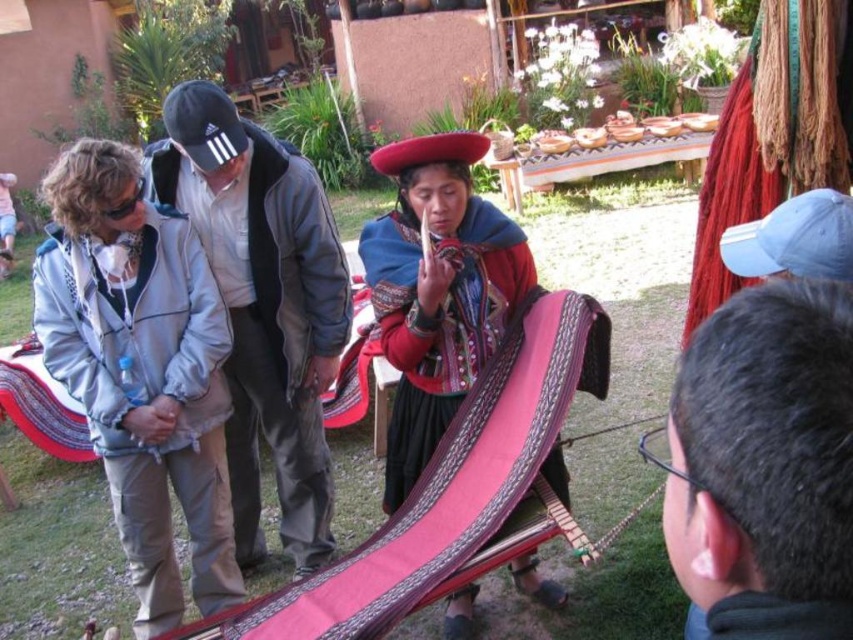
Between gray fabric jacket at center and red yarn at right, which one has less height?

Standing shorter between the two is red yarn at right.

Who is more distant from viewer, (x=190, y=122) or (x=844, y=109)?

The point (x=844, y=109) is behind.

Locate an element on the screen. The width and height of the screenshot is (853, 640). gray fabric jacket at center is located at coordinates (263, 305).

Does dark gray hair at upper right appear on the right side of matte red fabric at center?

Correct, you'll find dark gray hair at upper right to the right of matte red fabric at center.

Does dark gray hair at upper right appear under matte red fabric at center?

Indeed, dark gray hair at upper right is positioned under matte red fabric at center.

Between point (749, 342) and point (502, 268), which one is positioned in front?

Point (749, 342)

This screenshot has height=640, width=853. What are the coordinates of `dark gray hair at upper right` in the screenshot? It's located at (764, 449).

Who is higher up, matte red fabric at center or red yarn at right?

Positioned higher is red yarn at right.

Locate an element on the screen. The width and height of the screenshot is (853, 640). matte red fabric at center is located at coordinates (437, 291).

Who is more distant from viewer, (430, 388) or (785, 163)?

Positioned behind is point (785, 163).

Identify the location of matte red fabric at center. The width and height of the screenshot is (853, 640). (437, 291).